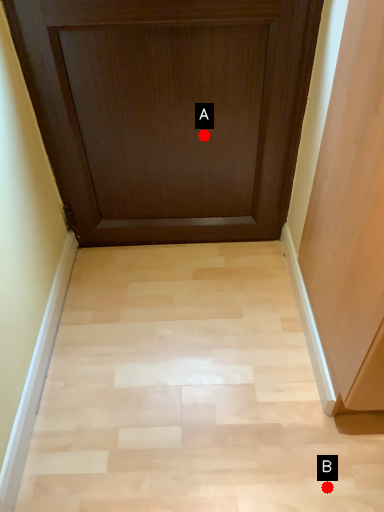
Question: Two points are circled on the image, labeled by A and B beside each circle. Among these points, which one is nearest to the camera?

Choices:
 (A) A is closer
 (B) B is closer

Answer: (B)